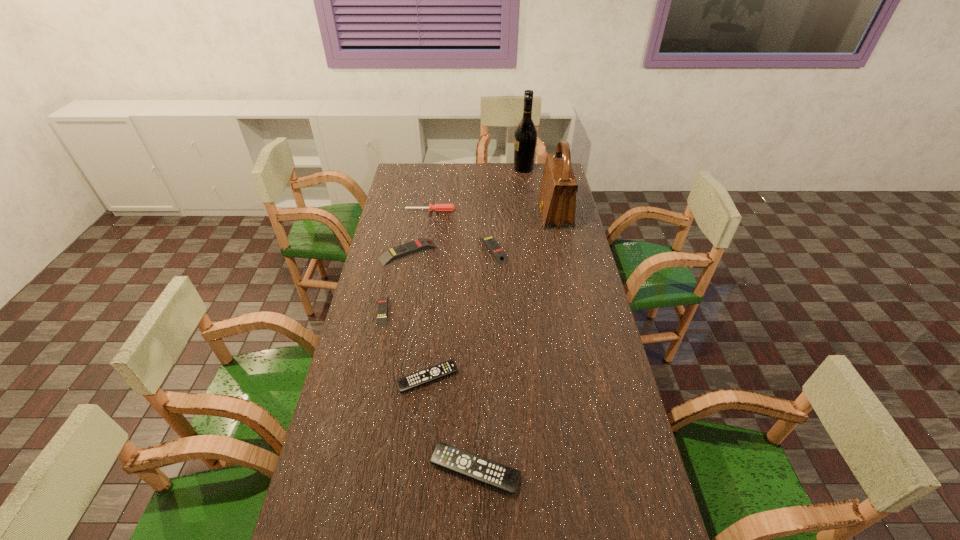
In order to click on black wine bottle in this screenshot , I will do `click(525, 138)`.

The image size is (960, 540). In order to click on wine bottle in this screenshot , I will do `click(525, 138)`.

The image size is (960, 540). Identify the location of shoulder bag. (557, 196).

Identify the location of red screwdriver. This screenshot has height=540, width=960. (437, 207).

Where is `the biggest yellow remote control`? Image resolution: width=960 pixels, height=540 pixels. the biggest yellow remote control is located at coordinates click(x=388, y=256).

Identify the location of the second biggest yellow remote control. (499, 254).

Locate an element on the screen. This screenshot has width=960, height=540. the nearest object is located at coordinates (499, 476).

Where is `the bigger black remote control`? the bigger black remote control is located at coordinates (499, 476).

Find the location of a particular element. the nearest yellow remote control is located at coordinates (382, 301).

The width and height of the screenshot is (960, 540). I want to click on the third nearest object, so click(x=382, y=301).